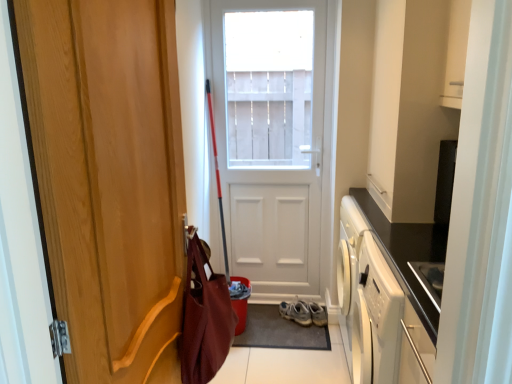
Question: Does wooden door at left, the first door viewed from the front, contain maroon fabric messenger bag at left?

Choices:
 (A) no
 (B) yes

Answer: (A)

Question: Can you confirm if wooden door at left, which is the 2th door in back-to-front order, is positioned to the right of maroon fabric messenger bag at left?

Choices:
 (A) yes
 (B) no

Answer: (B)

Question: Does wooden door at left, which is the 2th door in back-to-front order, come behind maroon fabric messenger bag at left?

Choices:
 (A) yes
 (B) no

Answer: (B)

Question: Are wooden door at left, which is the 2th door in back-to-front order, and maroon fabric messenger bag at left making contact?

Choices:
 (A) no
 (B) yes

Answer: (A)

Question: From the image's perspective, is wooden door at left, which is the 2th door in back-to-front order, under maroon fabric messenger bag at left?

Choices:
 (A) yes
 (B) no

Answer: (B)

Question: Can you confirm if wooden door at left, the 2th door from the right, is smaller than maroon fabric messenger bag at left?

Choices:
 (A) yes
 (B) no

Answer: (B)

Question: From a real-world perspective, is dark gray rubber doormat at center positioned under gray suede sneakers at lower center based on gravity?

Choices:
 (A) no
 (B) yes

Answer: (B)

Question: Is dark gray rubber doormat at center thinner than gray suede sneakers at lower center?

Choices:
 (A) yes
 (B) no

Answer: (B)

Question: Is dark gray rubber doormat at center at the right side of gray suede sneakers at lower center?

Choices:
 (A) yes
 (B) no

Answer: (B)

Question: From the image's perspective, would you say dark gray rubber doormat at center is shown under gray suede sneakers at lower center?

Choices:
 (A) no
 (B) yes

Answer: (B)

Question: Is dark gray rubber doormat at center looking in the opposite direction of gray suede sneakers at lower center?

Choices:
 (A) no
 (B) yes

Answer: (A)

Question: Considering the relative sizes of dark gray rubber doormat at center and gray suede sneakers at lower center in the image provided, is dark gray rubber doormat at center taller than gray suede sneakers at lower center?

Choices:
 (A) yes
 (B) no

Answer: (B)

Question: Would you say maroon fabric messenger bag at left contains white matte cabinet at upper right?

Choices:
 (A) yes
 (B) no

Answer: (B)